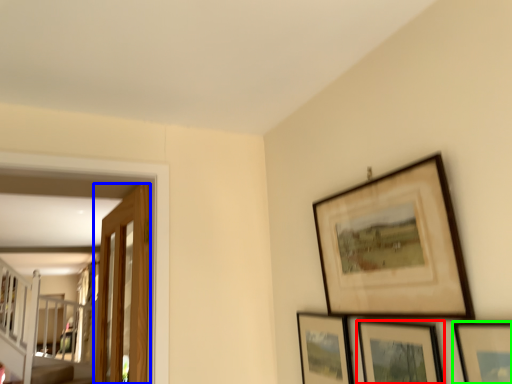
Question: Which is nearer to the picture frame (highlighted by a red box)? door (highlighted by a blue box) or picture frame (highlighted by a green box).

Choices:
 (A) door
 (B) picture frame

Answer: (B)